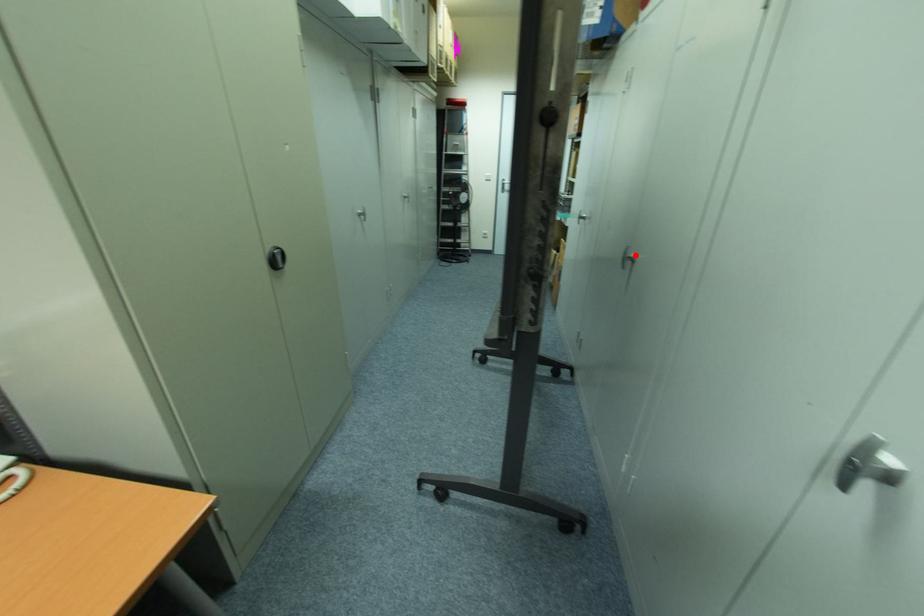
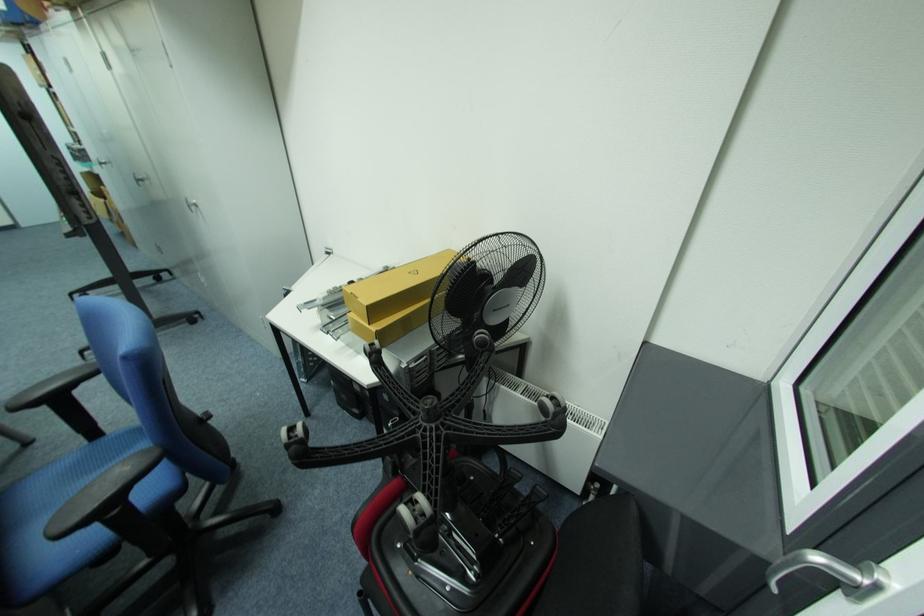
Where in the second image is the point corresponding to the highlighted location from the first image?

(141, 179)